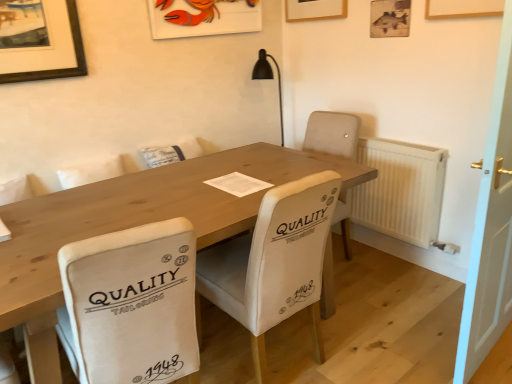
What is the approximate height of natural wood table at center?

It is 31.52 inches.

At what (x,y) coordinates should I click in order to perform the action: click on white fabric chair at center, arranged as the second chair when viewed from the left. Please return your answer as a coordinate pair (x, y). This screenshot has width=512, height=384. Looking at the image, I should click on (274, 262).

Locate an element on the screen. white plastic radiator at right is located at coordinates (400, 190).

The image size is (512, 384). What do you see at coordinates (390, 18) in the screenshot? I see `wooden picture frame at upper right, which is counted as the second picture frame, starting from the left` at bounding box center [390, 18].

Where is `matte plastic picture frame at upper center, the 1th picture frame from the left`? matte plastic picture frame at upper center, the 1th picture frame from the left is located at coordinates (203, 17).

How much distance is there between white plastic radiator at right and matte plastic picture frame at upper center, the 1th picture frame from the left?

They are 1.41 meters apart.

Which object is wider, white plastic radiator at right or matte plastic picture frame at upper center, the 1th picture frame from the left?

Wider between the two is white plastic radiator at right.

Does white plastic radiator at right turn towards matte plastic picture frame at upper center, which ranks as the 2th picture frame in right-to-left order?

No, white plastic radiator at right is not turned towards matte plastic picture frame at upper center, which ranks as the 2th picture frame in right-to-left order.

Is white plastic radiator at right situated inside matte plastic picture frame at upper center, the 1th picture frame from the left, or outside?

white plastic radiator at right cannot be found inside matte plastic picture frame at upper center, the 1th picture frame from the left.

Looking at this image, what's the angular difference between white plastic radiator at right and wooden picture frame at upper right, which is the 1th picture frame from right to left,'s facing directions?

The facing directions of white plastic radiator at right and wooden picture frame at upper right, which is the 1th picture frame from right to left, are 0.736 degrees apart.

Is white plastic radiator at right to the right of wooden picture frame at upper right, which is counted as the second picture frame, starting from the left, from the viewer's perspective?

Indeed, white plastic radiator at right is positioned on the right side of wooden picture frame at upper right, which is counted as the second picture frame, starting from the left.

Would you say white plastic radiator at right is outside wooden picture frame at upper right, which is counted as the second picture frame, starting from the left?

Yes.

From a real-world perspective, is white wooden door at right located higher than natural wood table at center?

Correct, in the physical world, white wooden door at right is higher than natural wood table at center.

What's the angular difference between white wooden door at right and natural wood table at center's facing directions?

The angle between the facing direction of white wooden door at right and the facing direction of natural wood table at center is 2.77 degrees.

Can you confirm if white wooden door at right is bigger than natural wood table at center?

No, white wooden door at right is not bigger than natural wood table at center.

Is natural wood table at center inside white wooden door at right?

That's incorrect, natural wood table at center is not inside white wooden door at right.

Is white plastic radiator at right a part of wooden picture frame at upper right, which is counted as the second picture frame, starting from the left?

No, white plastic radiator at right is not inside wooden picture frame at upper right, which is counted as the second picture frame, starting from the left.

From a real-world perspective, is wooden picture frame at upper right, which is the 1th picture frame from right to left, on white plastic radiator at right?

Yes, from a real-world perspective, wooden picture frame at upper right, which is the 1th picture frame from right to left, is on top of white plastic radiator at right.

Considering the positions of points (372, 36) and (441, 199), is point (372, 36) farther from camera compared to point (441, 199)?

Yes, point (372, 36) is farther from viewer.

The image size is (512, 384). Find the location of `picture frame located underneath the matte plastic picture frame at upper center, the 1th picture frame from the left (from a real-world perspective)`. picture frame located underneath the matte plastic picture frame at upper center, the 1th picture frame from the left (from a real-world perspective) is located at coordinates (390, 18).

From the image's perspective, is matte plastic picture frame at upper center, the 1th picture frame from the left, below wooden picture frame at upper right, which is the 1th picture frame from right to left?

Actually, matte plastic picture frame at upper center, the 1th picture frame from the left, appears above wooden picture frame at upper right, which is the 1th picture frame from right to left, in the image.

Considering the sizes of objects matte plastic picture frame at upper center, the 1th picture frame from the left, and wooden picture frame at upper right, which is the 1th picture frame from right to left, in the image provided, who is shorter, matte plastic picture frame at upper center, the 1th picture frame from the left, or wooden picture frame at upper right, which is the 1th picture frame from right to left,?

With less height is matte plastic picture frame at upper center, the 1th picture frame from the left.

Is point (256, 12) closer or farther from the camera than point (371, 4)?

Point (256, 12) is farther from the camera than point (371, 4).

From the image's perspective, would you say white fabric chair at center, which ranks as the 2th chair in right-to-left order, is shown under white fabric chair at center, the first chair positioned from the right?

Yes, from the image's perspective, white fabric chair at center, which ranks as the 2th chair in right-to-left order, is beneath white fabric chair at center, the first chair positioned from the right.

Considering the sizes of objects white fabric chair at center, which is counted as the first chair, starting from the left, and white fabric chair at center, the first chair positioned from the right, in the image provided, who is taller, white fabric chair at center, which is counted as the first chair, starting from the left, or white fabric chair at center, the first chair positioned from the right,?

Standing taller between the two is white fabric chair at center, the first chair positioned from the right.

Is white fabric chair at center, which ranks as the 2th chair in right-to-left order, oriented away from white fabric chair at center, the first chair positioned from the right?

white fabric chair at center, which ranks as the 2th chair in right-to-left order, does not have its back to white fabric chair at center, the first chair positioned from the right.

Find the location of a particular element. chair on the left of the white fabric chair at center, arranged as the second chair when viewed from the left is located at coordinates (131, 304).

From their relative heights in the image, would you say natural wood table at center is taller or shorter than white fabric chair at center, arranged as the second chair when viewed from the left?

Considering their sizes, natural wood table at center has less height than white fabric chair at center, arranged as the second chair when viewed from the left.

Is natural wood table at center positioned far away from white fabric chair at center, the first chair positioned from the right?

natural wood table at center is actually quite close to white fabric chair at center, the first chair positioned from the right.

Is natural wood table at center facing towards white fabric chair at center, the first chair positioned from the right?

Yes, natural wood table at center is facing white fabric chair at center, the first chair positioned from the right.

From the white plastic radiator at right, count 2nd picture frames backward and point to it. Please provide its 2D coordinates.

[(203, 17)]

The image size is (512, 384). In order to click on radiator below the wooden picture frame at upper right, which is the 1th picture frame from right to left (from a real-world perspective) in this screenshot , I will do `click(400, 190)`.

In the scene shown: Which object lies nearer to the anchor point white plastic radiator at right, wooden picture frame at upper right, which is counted as the second picture frame, starting from the left, or white fabric chair at center, the first chair positioned from the right?

wooden picture frame at upper right, which is counted as the second picture frame, starting from the left, lies closer to white plastic radiator at right than the other object.

Estimate the real-world distances between objects in this image. Which object is closer to white fabric chair at center, the first chair positioned from the right, matte plastic picture frame at upper center, the 1th picture frame from the left, or white plastic radiator at right?

The object closer to white fabric chair at center, the first chair positioned from the right, is white plastic radiator at right.

Which object lies nearer to the anchor point white fabric chair at center, arranged as the second chair when viewed from the left, wooden picture frame at upper right, which is the 1th picture frame from right to left, or natural wood table at center?

Based on the image, natural wood table at center appears to be nearer to white fabric chair at center, arranged as the second chair when viewed from the left.

Considering their positions, is natural wood table at center positioned further to white fabric chair at center, which ranks as the 2th chair in right-to-left order, than wooden picture frame at upper right, which is counted as the second picture frame, starting from the left?

wooden picture frame at upper right, which is counted as the second picture frame, starting from the left, lies further to white fabric chair at center, which ranks as the 2th chair in right-to-left order, than the other object.

Looking at the image, which one is located closer to wooden picture frame at upper right, which is the 1th picture frame from right to left, white fabric chair at center, which ranks as the 2th chair in right-to-left order, or natural wood table at center?

natural wood table at center lies closer to wooden picture frame at upper right, which is the 1th picture frame from right to left, than the other object.

Considering their positions, is white fabric chair at center, arranged as the second chair when viewed from the left, positioned further to white fabric chair at center, which ranks as the 2th chair in right-to-left order, than white plastic radiator at right?

Among the two, white plastic radiator at right is located further to white fabric chair at center, which ranks as the 2th chair in right-to-left order.

Estimate the real-world distances between objects in this image. Which object is closer to white plastic radiator at right, wooden picture frame at upper right, which is the 1th picture frame from right to left, or matte plastic picture frame at upper center, which ranks as the 2th picture frame in right-to-left order?

Based on the image, wooden picture frame at upper right, which is the 1th picture frame from right to left, appears to be nearer to white plastic radiator at right.

Looking at the image, which one is located further to wooden picture frame at upper right, which is counted as the second picture frame, starting from the left, natural wood table at center or white plastic radiator at right?

natural wood table at center is positioned further to the anchor wooden picture frame at upper right, which is counted as the second picture frame, starting from the left.

In order to click on chair between matte plastic picture frame at upper center, the 1th picture frame from the left, and white fabric chair at center, which ranks as the 2th chair in right-to-left order, from top to bottom in this screenshot , I will do 274,262.

This screenshot has height=384, width=512. In order to click on chair between natural wood table at center and white plastic radiator at right in the horizontal direction in this screenshot , I will do `click(274, 262)`.

This screenshot has height=384, width=512. Find the location of `radiator between matte plastic picture frame at upper center, the 1th picture frame from the left, and white fabric chair at center, arranged as the second chair when viewed from the left, in the up-down direction`. radiator between matte plastic picture frame at upper center, the 1th picture frame from the left, and white fabric chair at center, arranged as the second chair when viewed from the left, in the up-down direction is located at coordinates (400, 190).

Identify the location of radiator between white fabric chair at center, which ranks as the 2th chair in right-to-left order, and white wooden door at right from left to right. (400, 190).